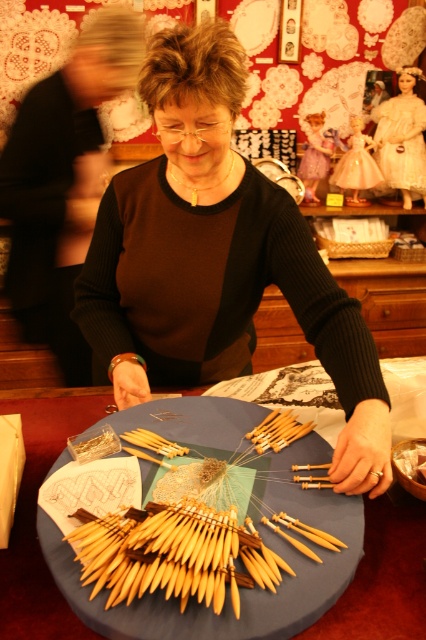
You are a craft fair attendee who wants to know the position of the wooden knitting needles at center relative to the white lace dress at center. Which object is on the left side?

The wooden knitting needles at center is to the left of white lace dress at center.

You are a photographer trying to capture the details of the lace fabric at the craft fair. You notice two points on the table where lace samples are displayed. The first point is at coordinates point (x=339, y=568), and the second is at point (x=409, y=172). If you want to focus on the lace sample that is closer to the camera, which point should you aim your camera at?

Point (x=339, y=568) is closer to the camera than point (x=409, y=172), so you should aim your camera at point (x=339, y=568) to focus on the lace sample that is closer.